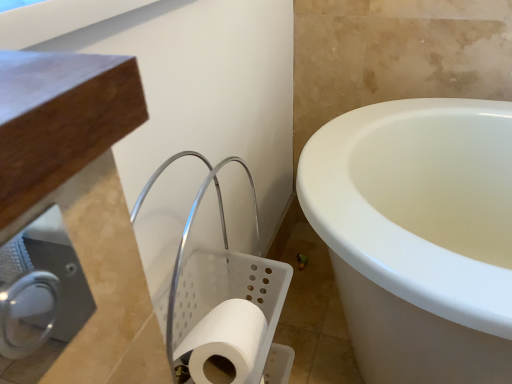
Question: Is satin silver toilet paper holder at lower left taller or shorter than white matte toilet paper at lower center?

Choices:
 (A) short
 (B) tall

Answer: (A)

Question: Would you say satin silver toilet paper holder at lower left is to the left or to the right of white matte toilet paper at lower center in the picture?

Choices:
 (A) right
 (B) left

Answer: (B)

Question: Considering their positions, is satin silver toilet paper holder at lower left located in front of or behind white matte toilet paper at lower center?

Choices:
 (A) behind
 (B) front

Answer: (B)

Question: Considering their positions, is white matte toilet paper at lower center located in front of or behind satin silver toilet paper holder at lower left?

Choices:
 (A) front
 (B) behind

Answer: (B)

Question: From a real-world perspective, is white matte toilet paper at lower center physically located above or below satin silver toilet paper holder at lower left?

Choices:
 (A) below
 (B) above

Answer: (A)

Question: Is white matte toilet paper at lower center taller or shorter than satin silver toilet paper holder at lower left?

Choices:
 (A) short
 (B) tall

Answer: (B)

Question: Based on their positions, is white matte toilet paper at lower center located to the left or right of satin silver toilet paper holder at lower left?

Choices:
 (A) right
 (B) left

Answer: (A)